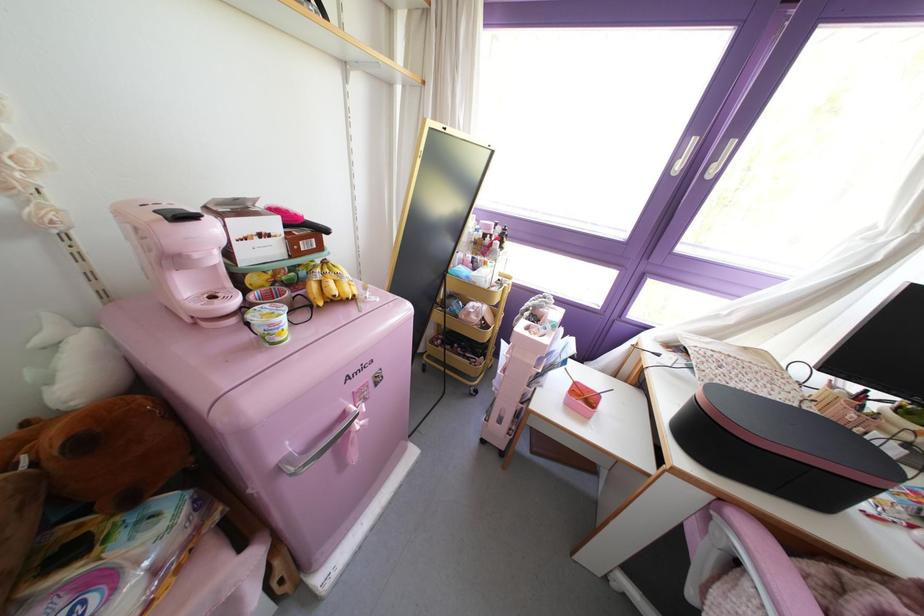
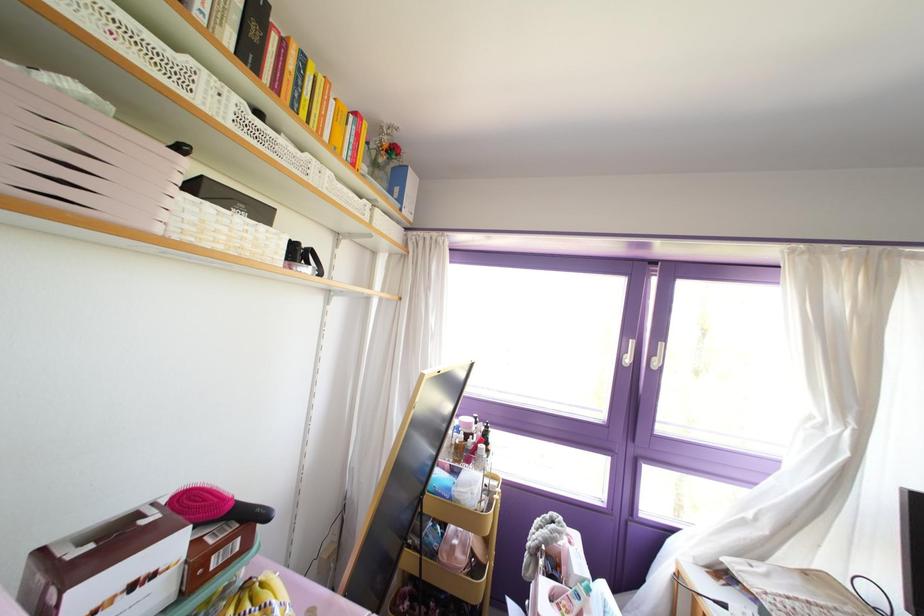
Find the pixel in the second image that matches pixel 259 235 in the first image.

(132, 586)